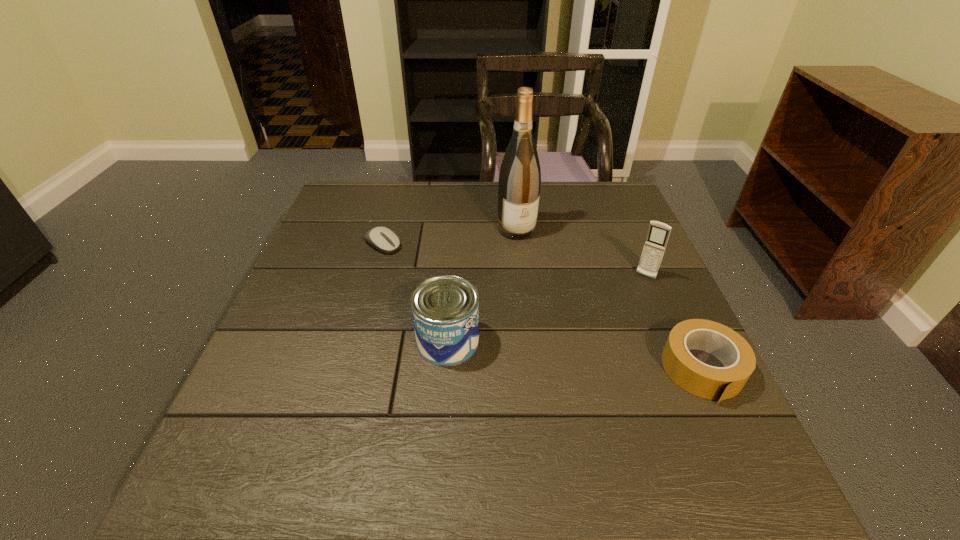
At what (x,y) coordinates should I click in order to perform the action: click on object that is at the near edge. Please return your answer as a coordinate pair (x, y). Looking at the image, I should click on (713, 383).

Locate an element on the screen. The width and height of the screenshot is (960, 540). object that is at the left edge is located at coordinates (382, 239).

Find the location of a particular element. The image size is (960, 540). duct tape that is at the right edge is located at coordinates (713, 383).

The height and width of the screenshot is (540, 960). What are the coordinates of `cellular telephone situated at the right edge` in the screenshot? It's located at (658, 234).

Find the location of a particular element. object that is at the near right corner is located at coordinates (713, 383).

This screenshot has height=540, width=960. Identify the location of vacant space at the far edge of the desktop. (561, 206).

The width and height of the screenshot is (960, 540). In the image, there is a desktop. Find the location of `vacant space at the near edge`. vacant space at the near edge is located at coordinates (348, 415).

Find the location of a particular element. free location at the left edge of the desktop is located at coordinates (343, 302).

You are a GUI agent. You are given a task and a screenshot of the screen. Output one action in this format:
    pyautogui.click(x=<x>, y=<y>)
    Task: Click on the free space at the right edge of the desktop
    This screenshot has width=960, height=540.
    Given the screenshot: What is the action you would take?
    pyautogui.click(x=612, y=231)

Locate an element on the screen. free space at the far right corner of the desktop is located at coordinates (595, 186).